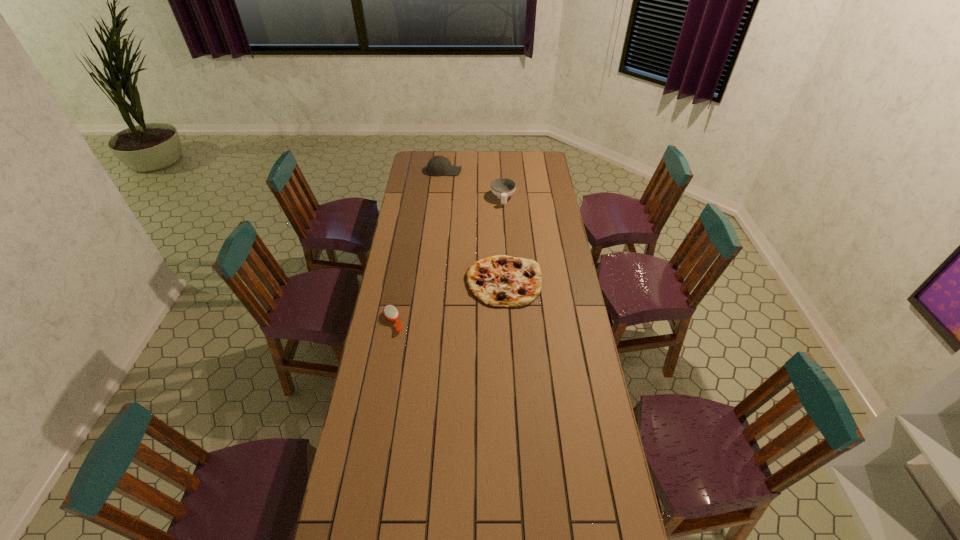
Find the location of a particular element. The width and height of the screenshot is (960, 540). unoccupied area between the third nearest object and the baseball cap is located at coordinates (473, 185).

In order to click on free spot between the chinaware and the pizza in this screenshot , I will do `click(503, 240)`.

Identify the location of vacant space that is in between the hairbrush and the farthest object. (419, 246).

Where is `free space between the baseball cap and the nearest object`? free space between the baseball cap and the nearest object is located at coordinates (419, 246).

Image resolution: width=960 pixels, height=540 pixels. Find the location of `vacant space that is in between the nearest object and the second nearest object`. vacant space that is in between the nearest object and the second nearest object is located at coordinates (448, 301).

This screenshot has width=960, height=540. I want to click on free space between the farthest object and the hairbrush, so click(419, 246).

In order to click on free space that is in between the hairbrush and the pizza in this screenshot , I will do `click(448, 301)`.

Find the location of a particular element. This screenshot has height=540, width=960. blank region between the nearest object and the third shortest object is located at coordinates (448, 260).

Image resolution: width=960 pixels, height=540 pixels. What are the coordinates of `the second closest object to the pizza` in the screenshot? It's located at (503, 188).

The width and height of the screenshot is (960, 540). I want to click on the third closest object to the second tallest object, so click(390, 312).